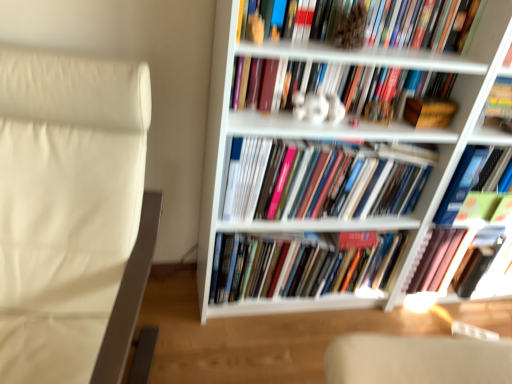
Question: From the image's perspective, is hardcover book at center, the 1th book from the bottom, over hardcover book at upper center, the 6th book in the bottom-to-top sequence?

Choices:
 (A) no
 (B) yes

Answer: (A)

Question: Is hardcover book at center, the sixth book positioned from the top, outside hardcover book at upper center, the first book when ordered from top to bottom?

Choices:
 (A) yes
 (B) no

Answer: (A)

Question: Could hardcover book at upper center, the 6th book in the bottom-to-top sequence, be considered to be inside hardcover book at center, the 1th book from the bottom?

Choices:
 (A) yes
 (B) no

Answer: (B)

Question: Does hardcover book at center, the 1th book from the bottom, have a smaller size compared to hardcover book at upper center, the 6th book in the bottom-to-top sequence?

Choices:
 (A) no
 (B) yes

Answer: (A)

Question: Considering the relative sizes of hardcover book at center, the sixth book positioned from the top, and hardcover book at upper center, the first book when ordered from top to bottom, in the image provided, is hardcover book at center, the sixth book positioned from the top, bigger than hardcover book at upper center, the first book when ordered from top to bottom,?

Choices:
 (A) no
 (B) yes

Answer: (B)

Question: In terms of height, does hardcover book at upper center, the first book when ordered from top to bottom, look taller or shorter compared to white leather rocking chair at left?

Choices:
 (A) short
 (B) tall

Answer: (A)

Question: Based on their positions, is hardcover book at upper center, the first book when ordered from top to bottom, located to the left or right of white leather rocking chair at left?

Choices:
 (A) right
 (B) left

Answer: (A)

Question: Does point (256, 34) appear closer or farther from the camera than point (10, 281)?

Choices:
 (A) farther
 (B) closer

Answer: (B)

Question: Which is correct: hardcover book at upper center, the 6th book in the bottom-to-top sequence, is inside white leather rocking chair at left, or outside of it?

Choices:
 (A) outside
 (B) inside

Answer: (A)

Question: Considering the positions of hardcover book at upper center, the 6th book in the bottom-to-top sequence, and green matte book at upper right, which is the 4th book from top to bottom, in the image, is hardcover book at upper center, the 6th book in the bottom-to-top sequence, wider or thinner than green matte book at upper right, which is the 4th book from top to bottom,?

Choices:
 (A) thin
 (B) wide

Answer: (A)

Question: Based on their sizes in the image, would you say hardcover book at upper center, the 6th book in the bottom-to-top sequence, is bigger or smaller than green matte book at upper right, which is the third book in bottom-to-top order?

Choices:
 (A) big
 (B) small

Answer: (B)

Question: Would you say hardcover book at upper center, the first book when ordered from top to bottom, is to the left or to the right of green matte book at upper right, which is the third book in bottom-to-top order, in the picture?

Choices:
 (A) right
 (B) left

Answer: (B)

Question: Relative to green matte book at upper right, which is the third book in bottom-to-top order, is hardcover book at upper center, the first book when ordered from top to bottom, in front or behind?

Choices:
 (A) behind
 (B) front

Answer: (B)

Question: Does point (306, 185) appear closer or farther from the camera than point (123, 294)?

Choices:
 (A) closer
 (B) farther

Answer: (B)

Question: Is white matte bookcase at upper right to the left or to the right of white leather rocking chair at left in the image?

Choices:
 (A) left
 (B) right

Answer: (B)